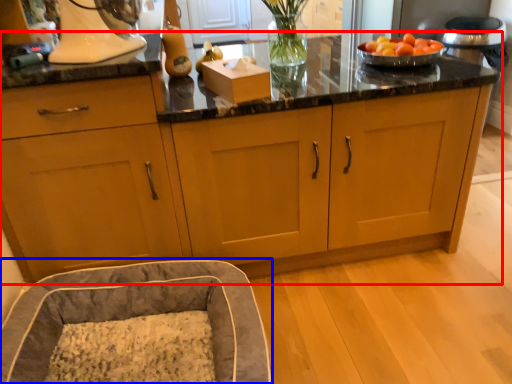
Question: Which object is further to the camera taking this photo, cabinetry (highlighted by a red box) or bean bag chair (highlighted by a blue box)?

Choices:
 (A) cabinetry
 (B) bean bag chair

Answer: (A)